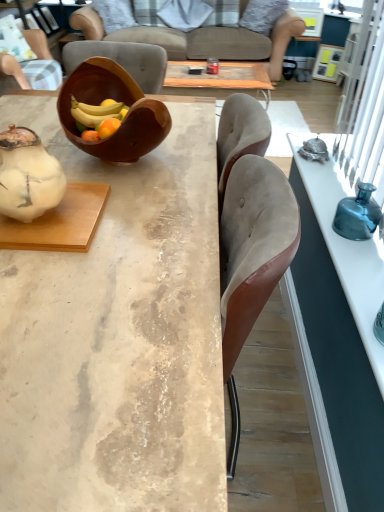
Find the location of a particular element. vacant space in front of brown wooden bowl at center is located at coordinates (148, 204).